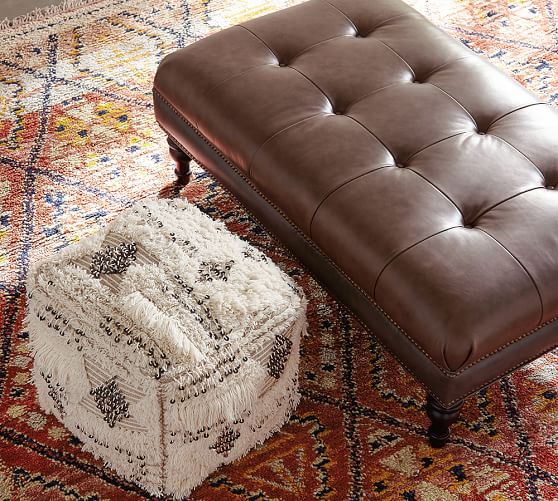
Identify the location of ottoman. The image size is (558, 501). (372, 225).